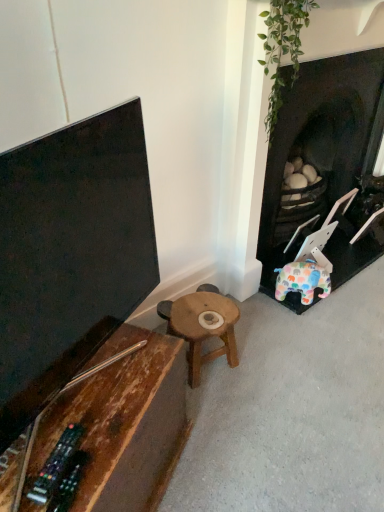
Question: Is dark brown wood fireplace at right facing away from wooden stool at center, the 1th table viewed from the back?

Choices:
 (A) yes
 (B) no

Answer: (B)

Question: Is the depth of dark brown wood fireplace at right greater than that of wooden stool at center, the 2th table viewed from the front?

Choices:
 (A) no
 (B) yes

Answer: (A)

Question: Considering the relative sizes of dark brown wood fireplace at right and wooden stool at center, the 1th table viewed from the back, in the image provided, is dark brown wood fireplace at right bigger than wooden stool at center, the 1th table viewed from the back,?

Choices:
 (A) yes
 (B) no

Answer: (A)

Question: From a real-world perspective, is dark brown wood fireplace at right located higher than wooden stool at center, the 2th table viewed from the front?

Choices:
 (A) no
 (B) yes

Answer: (B)

Question: From the image's perspective, is dark brown wood fireplace at right below wooden stool at center, the 1th table viewed from the back?

Choices:
 (A) no
 (B) yes

Answer: (A)

Question: Is rustic wood table at lower left, marked as the 2th table in a back-to-front arrangement, wider or thinner than dark brown wood fireplace at right?

Choices:
 (A) wide
 (B) thin

Answer: (A)

Question: In the image, is rustic wood table at lower left, marked as the 2th table in a back-to-front arrangement, on the left side or the right side of dark brown wood fireplace at right?

Choices:
 (A) right
 (B) left

Answer: (B)

Question: Considering the positions of rustic wood table at lower left, marked as the 2th table in a back-to-front arrangement, and dark brown wood fireplace at right in the image, is rustic wood table at lower left, marked as the 2th table in a back-to-front arrangement, taller or shorter than dark brown wood fireplace at right?

Choices:
 (A) short
 (B) tall

Answer: (A)

Question: From the image's perspective, relative to dark brown wood fireplace at right, is rustic wood table at lower left, marked as the 2th table in a back-to-front arrangement, above or below?

Choices:
 (A) below
 (B) above

Answer: (A)

Question: Considering the positions of dark brown wood fireplace at right and wooden stool at center, the 2th table viewed from the front, in the image, is dark brown wood fireplace at right taller or shorter than wooden stool at center, the 2th table viewed from the front,?

Choices:
 (A) short
 (B) tall

Answer: (B)

Question: Relative to wooden stool at center, the 2th table viewed from the front, is dark brown wood fireplace at right in front or behind?

Choices:
 (A) front
 (B) behind

Answer: (A)

Question: Considering the positions of dark brown wood fireplace at right and wooden stool at center, the 2th table viewed from the front, in the image, is dark brown wood fireplace at right wider or thinner than wooden stool at center, the 2th table viewed from the front,?

Choices:
 (A) thin
 (B) wide

Answer: (B)

Question: Considering the positions of point (357, 249) and point (158, 303), is point (357, 249) closer or farther from the camera than point (158, 303)?

Choices:
 (A) closer
 (B) farther

Answer: (B)

Question: In terms of width, does wooden stool at center, the 2th table viewed from the front, look wider or thinner when compared to dark brown wood fireplace at right?

Choices:
 (A) thin
 (B) wide

Answer: (A)

Question: In terms of height, does wooden stool at center, the 2th table viewed from the front, look taller or shorter compared to dark brown wood fireplace at right?

Choices:
 (A) short
 (B) tall

Answer: (A)